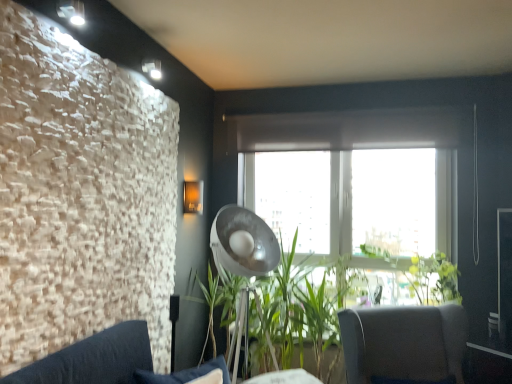
The image size is (512, 384). Describe the element at coordinates (404, 344) in the screenshot. I see `green leafy plant at center` at that location.

This screenshot has width=512, height=384. I want to click on green leafy plant at center, so click(x=433, y=278).

Identify the location of dark gray fabric couch at lower left. coord(93,359).

At what (x,y) coordinates should I click in order to perform the action: click on green leafy plant at center. Please return your answer as a coordinate pair (x, y). The image size is (512, 384). Looking at the image, I should click on (404, 344).

Considering the positions of points (402, 380) and (420, 306), is point (402, 380) farther from camera compared to point (420, 306)?

No, (402, 380) is closer to viewer.

Is green leafy plant at center in front of or behind dark gray fabric chair at lower right in the image?

Visually, green leafy plant at center is located behind dark gray fabric chair at lower right.

Considering the sizes of dark gray fabric chair at lower right and green leafy plant at center in the image, is dark gray fabric chair at lower right taller or shorter than green leafy plant at center?

Clearly, dark gray fabric chair at lower right is taller compared to green leafy plant at center.

Could you tell me if dark gray fabric chair at lower right is turned towards green leafy plant at center?

No.

Can you tell me how much dark gray fabric chair at lower right and green leafy plant at center differ in facing direction?

The facing directions of dark gray fabric chair at lower right and green leafy plant at center are 22.7 degrees apart.

Can you confirm if dark gray fabric couch at lower left is thinner than green leafy plant at center?

Yes, dark gray fabric couch at lower left is thinner than green leafy plant at center.

Is dark gray fabric couch at lower left beside green leafy plant at center?

No, dark gray fabric couch at lower left is not next to green leafy plant at center.

Considering the relative sizes of dark gray fabric couch at lower left and green leafy plant at center in the image provided, is dark gray fabric couch at lower left taller than green leafy plant at center?

In fact, dark gray fabric couch at lower left may be shorter than green leafy plant at center.

Based on the photo, how different are the orientations of dark gray fabric couch at lower left and green leafy plant at center in degrees?

67.4 degrees separate the facing orientations of dark gray fabric couch at lower left and green leafy plant at center.

Which of these two, dark gray fabric couch at lower left or green leafy plant at center, is thinner?

dark gray fabric couch at lower left.

Considering the relative sizes of dark gray fabric couch at lower left and green leafy plant at center in the image provided, is dark gray fabric couch at lower left shorter than green leafy plant at center?

Correct, dark gray fabric couch at lower left is not as tall as green leafy plant at center.

How far apart are dark gray fabric couch at lower left and green leafy plant at center?

dark gray fabric couch at lower left and green leafy plant at center are 7.53 feet apart from each other.

Does dark gray fabric couch at lower left touch green leafy plant at center?

No, dark gray fabric couch at lower left is not beside green leafy plant at center.

Would you say dark gray fabric chair at lower right is to the left or to the right of dark gray fabric couch at lower left in the picture?

From the image, it's evident that dark gray fabric chair at lower right is to the right of dark gray fabric couch at lower left.

Identify the location of chair that is under the dark gray fabric couch at lower left (from a real-world perspective). The image size is (512, 384). (404, 343).

From the image's perspective, is dark gray fabric chair at lower right above dark gray fabric couch at lower left?

No, from the image's perspective, dark gray fabric chair at lower right is not on top of dark gray fabric couch at lower left.

What's the angular difference between dark gray fabric chair at lower right and dark gray fabric couch at lower left's facing directions?

They differ by 38.8 degrees in their facing directions.

Which object is wider, metallic silver lamp at center or dark gray fabric couch at lower left?

Wider between the two is metallic silver lamp at center.

From a real-world perspective, which is physically above, metallic silver lamp at center or dark gray fabric couch at lower left?

metallic silver lamp at center is physically above.

Which point is more distant from viewer, [245,301] or [146,326]?

Point [245,301]

Does metallic silver lamp at center have a smaller size compared to dark gray fabric couch at lower left?

Actually, metallic silver lamp at center might be larger than dark gray fabric couch at lower left.

Is green leafy plant at center looking in the opposite direction of dark gray fabric chair at lower right?

That's not correct — green leafy plant at center is not looking away from dark gray fabric chair at lower right.

Considering the sizes of objects green leafy plant at center and dark gray fabric chair at lower right in the image provided, who is thinner, green leafy plant at center or dark gray fabric chair at lower right?

green leafy plant at center.

The width and height of the screenshot is (512, 384). Find the location of `chair below the green leafy plant at center (from a real-world perspective)`. chair below the green leafy plant at center (from a real-world perspective) is located at coordinates (404, 343).

Does green leafy plant at center have a larger size compared to dark gray fabric chair at lower right?

No.

Locate an element on the screen. houseplant lying behind the dark gray fabric chair at lower right is located at coordinates (404, 344).

Where is `plant located above the dark gray fabric chair at lower right (from a real-world perspective)`? The image size is (512, 384). plant located above the dark gray fabric chair at lower right (from a real-world perspective) is located at coordinates (433, 278).

Estimate the real-world distances between objects in this image. Which object is closer to dark gray fabric couch at lower left, metallic silver lamp at center or green leafy plant at center?

Based on the image, metallic silver lamp at center appears to be nearer to dark gray fabric couch at lower left.

Which object lies nearer to the anchor point green leafy plant at center, metallic silver lamp at center or dark gray fabric chair at lower right?

Among the two, dark gray fabric chair at lower right is located nearer to green leafy plant at center.

Estimate the real-world distances between objects in this image. Which object is closer to green leafy plant at center, dark gray fabric couch at lower left or metallic silver lamp at center?

Among the two, metallic silver lamp at center is located nearer to green leafy plant at center.

Considering their positions, is dark gray fabric chair at lower right positioned closer to green leafy plant at center than dark gray fabric couch at lower left?

dark gray fabric chair at lower right is closer to green leafy plant at center.

From the image, which object appears to be farther from metallic silver lamp at center, dark gray fabric couch at lower left or dark gray fabric chair at lower right?

→ dark gray fabric couch at lower left is positioned further to the anchor metallic silver lamp at center.

Looking at the image, which one is located further to dark gray fabric chair at lower right, green leafy plant at center or dark gray fabric couch at lower left?

dark gray fabric couch at lower left is positioned further to the anchor dark gray fabric chair at lower right.

Looking at the image, which one is located closer to green leafy plant at center, green leafy plant at center or dark gray fabric chair at lower right?

Among the two, dark gray fabric chair at lower right is located nearer to green leafy plant at center.

From the image, which object appears to be farther from green leafy plant at center, metallic silver lamp at center or green leafy plant at center?

metallic silver lamp at center lies further to green leafy plant at center than the other object.

Where is `chair positioned between dark gray fabric couch at lower left and green leafy plant at center from near to far`? chair positioned between dark gray fabric couch at lower left and green leafy plant at center from near to far is located at coordinates (404, 343).

The width and height of the screenshot is (512, 384). I want to click on lamp between dark gray fabric couch at lower left and dark gray fabric chair at lower right, so click(243, 243).

Locate an element on the screen. This screenshot has height=384, width=512. houseplant positioned between dark gray fabric couch at lower left and green leafy plant at center from near to far is located at coordinates (404, 344).

Image resolution: width=512 pixels, height=384 pixels. In order to click on lamp situated between dark gray fabric couch at lower left and green leafy plant at center from left to right in this screenshot , I will do `click(243, 243)`.